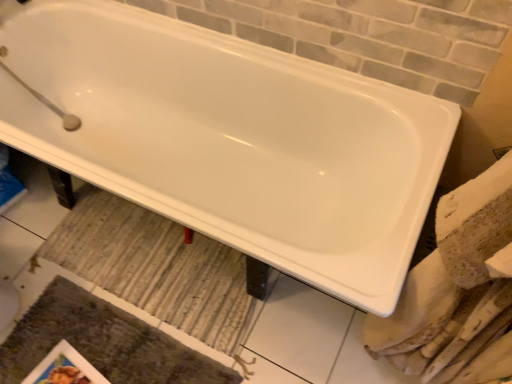
Identify the location of free space to the right of textured gray bath mat at lower left, which is the 1th bath mat in bottom-to-top order. (256, 322).